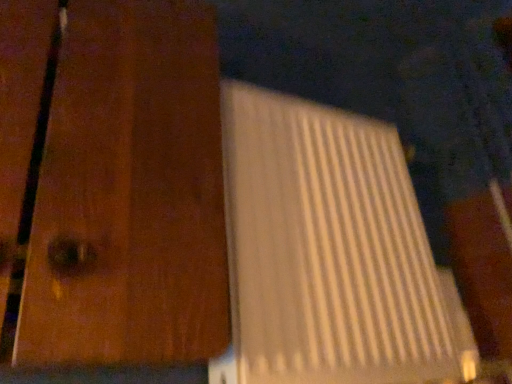
Question: Is white plastic laptop at center smaller than white matte door at center?

Choices:
 (A) no
 (B) yes

Answer: (B)

Question: Is white plastic laptop at center looking in the opposite direction of white matte door at center?

Choices:
 (A) no
 (B) yes

Answer: (A)

Question: Is white plastic laptop at center at the right side of white matte door at center?

Choices:
 (A) yes
 (B) no

Answer: (A)

Question: Does white plastic laptop at center have a lesser height compared to white matte door at center?

Choices:
 (A) yes
 (B) no

Answer: (A)

Question: Is white plastic laptop at center oriented towards white matte door at center?

Choices:
 (A) no
 (B) yes

Answer: (A)

Question: From the image's perspective, is white plastic laptop at center over white matte door at center?

Choices:
 (A) yes
 (B) no

Answer: (B)

Question: From a real-world perspective, is white matte door at center located beneath white plastic laptop at center?

Choices:
 (A) yes
 (B) no

Answer: (B)

Question: Are white matte door at center and white plastic laptop at center beside each other?

Choices:
 (A) yes
 (B) no

Answer: (B)

Question: Can you confirm if white matte door at center is positioned to the right of white plastic laptop at center?

Choices:
 (A) no
 (B) yes

Answer: (A)

Question: Considering the relative sizes of white matte door at center and white plastic laptop at center in the image provided, is white matte door at center shorter than white plastic laptop at center?

Choices:
 (A) no
 (B) yes

Answer: (A)

Question: Does white matte door at center have a greater height compared to white plastic laptop at center?

Choices:
 (A) yes
 (B) no

Answer: (A)

Question: From the image's perspective, is white matte door at center beneath white plastic laptop at center?

Choices:
 (A) yes
 (B) no

Answer: (B)

Question: Is white matte door at center in front of or behind white plastic laptop at center in the image?

Choices:
 (A) behind
 (B) front

Answer: (B)